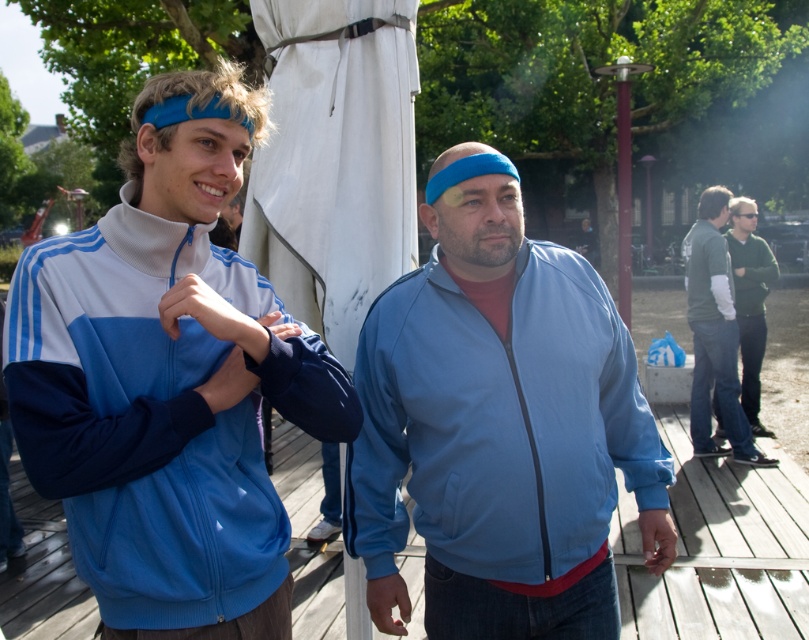
You are planning to take a photo of the blue matte jacket at center and the green sweater at right. To ensure both are in frame, should you adjust your camera to the left or to the right?

The blue matte jacket at center is to the left of the green sweater at right, so you should adjust your camera to the right to include both in the frame.

You are organizing a clothing donation drive and need to determine which item takes up less space. Based on the image, which of the two items, the matte blue track jacket at left or the green sweater at right, is more compact?

The matte blue track jacket at left is thinner than the green sweater at right, so it is more compact and takes up less space.